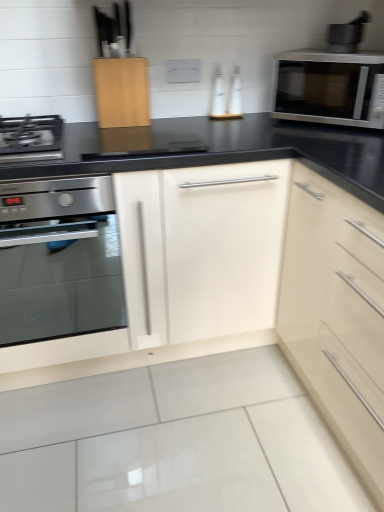
You are a GUI agent. You are given a task and a screenshot of the screen. Output one action in this format:
    pyautogui.click(x=<x>, y=<y>)
    Task: Click on the blank space above satin silver microwave at upper right (from a real-world perspective)
    This screenshot has height=512, width=384.
    Given the screenshot: What is the action you would take?
    pyautogui.click(x=343, y=52)